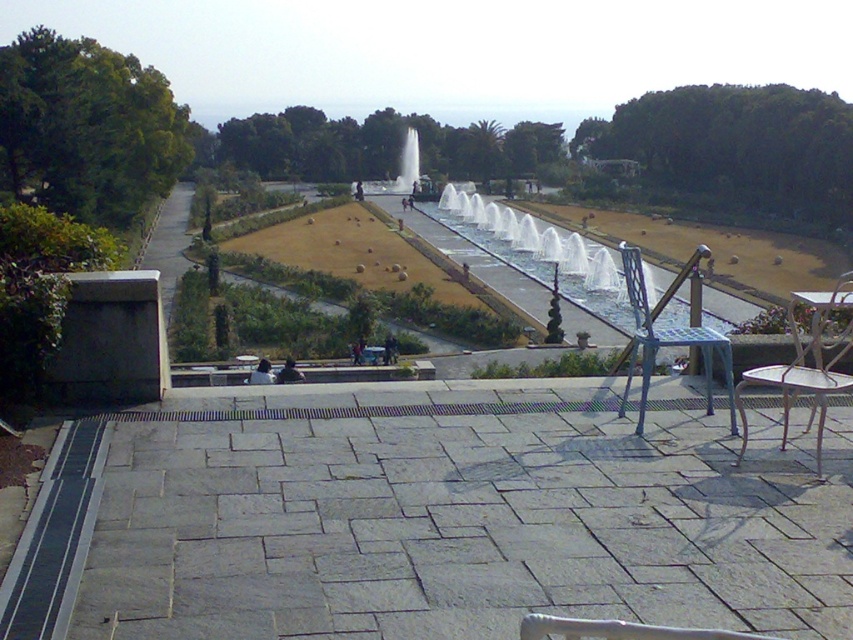
You are standing on the elevated stone platform and want to walk to the metallic white chair at lower right. Which direction should you walk to avoid the clear glass water at center?

You should walk to the right to avoid the clear glass water at center, as the clear glass water at center is located to the left of the metallic white chair at lower right.